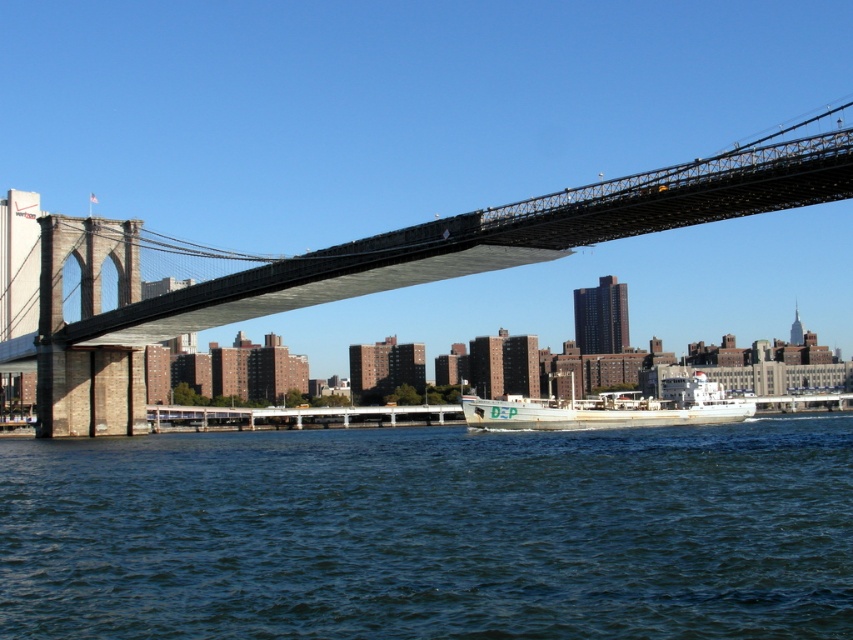
From the picture: Does concrete bridge at center appear under white matte boat at center?

No.

Who is more forward, [102,419] or [682,381]?

Point [682,381] is more forward.

Find the location of a particular element. This screenshot has width=853, height=640. concrete bridge at center is located at coordinates (378, 266).

From the picture: Does dark blue water at center appear under concrete bridge at center?

Yes.

Does dark blue water at center have a lesser height compared to concrete bridge at center?

Yes.

Who is more forward, (659, 536) or (44, 220)?

Positioned in front is point (659, 536).

Identify the location of dark blue water at center. (432, 532).

Can you confirm if dark blue water at center is wider than white matte boat at center?

Yes, dark blue water at center is wider than white matte boat at center.

Does dark blue water at center appear on the right side of white matte boat at center?

Incorrect, dark blue water at center is not on the right side of white matte boat at center.

Between point (416, 566) and point (468, 420), which one is positioned behind?

The point (468, 420) is more distant.

The image size is (853, 640). In order to click on dark blue water at center in this screenshot , I will do `click(432, 532)`.